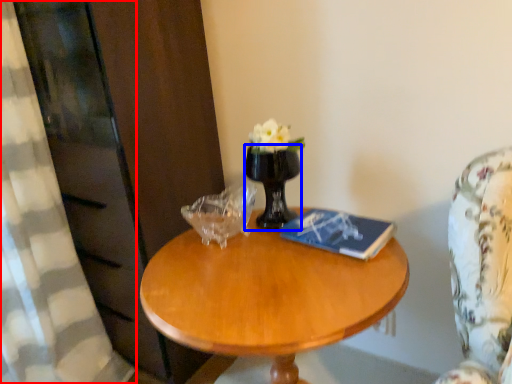
Question: Which point is closer to the camera, curtain (highlighted by a red box) or vase (highlighted by a blue box)?

Choices:
 (A) curtain
 (B) vase

Answer: (A)